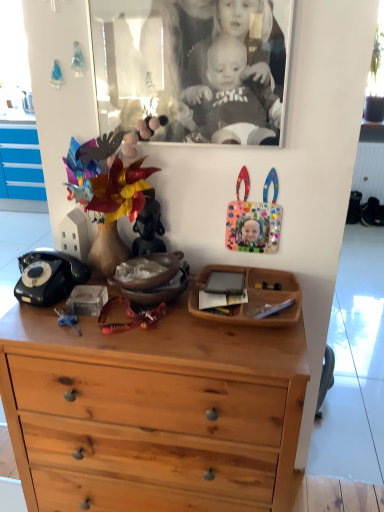
Question: Considering the relative sizes of black glass picture frame at upper center and light brown wood chest of drawers at center in the image provided, is black glass picture frame at upper center bigger than light brown wood chest of drawers at center?

Choices:
 (A) yes
 (B) no

Answer: (B)

Question: Is black glass picture frame at upper center shorter than light brown wood chest of drawers at center?

Choices:
 (A) no
 (B) yes

Answer: (B)

Question: Is black glass picture frame at upper center aimed at light brown wood chest of drawers at center?

Choices:
 (A) no
 (B) yes

Answer: (A)

Question: Is black glass picture frame at upper center closer to the viewer compared to light brown wood chest of drawers at center?

Choices:
 (A) yes
 (B) no

Answer: (B)

Question: Is black glass picture frame at upper center placed right next to light brown wood chest of drawers at center?

Choices:
 (A) yes
 (B) no

Answer: (B)

Question: Is point (109, 419) positioned closer to the camera than point (236, 80)?

Choices:
 (A) closer
 (B) farther

Answer: (B)

Question: In terms of size, does light brown wood chest of drawers at center appear bigger or smaller than black glass picture frame at upper center?

Choices:
 (A) big
 (B) small

Answer: (A)

Question: Considering the positions of light brown wood chest of drawers at center and black glass picture frame at upper center in the image, is light brown wood chest of drawers at center taller or shorter than black glass picture frame at upper center?

Choices:
 (A) short
 (B) tall

Answer: (B)

Question: Is light brown wood chest of drawers at center wider or thinner than black glass picture frame at upper center?

Choices:
 (A) thin
 (B) wide

Answer: (B)

Question: From the image's perspective, is light brown wood chest of drawers at center above or below colorful plastic frame at upper right, positioned as the 2th toy in left-to-right order?

Choices:
 (A) above
 (B) below

Answer: (B)

Question: Considering their positions, is light brown wood chest of drawers at center located in front of or behind colorful plastic frame at upper right, the 1th toy in the right-to-left sequence?

Choices:
 (A) behind
 (B) front

Answer: (B)

Question: Looking at the image, does light brown wood chest of drawers at center seem bigger or smaller compared to colorful plastic frame at upper right, the 1th toy in the right-to-left sequence?

Choices:
 (A) big
 (B) small

Answer: (A)

Question: Based on their positions, is light brown wood chest of drawers at center located to the left or right of colorful plastic frame at upper right, the 1th toy in the right-to-left sequence?

Choices:
 (A) left
 (B) right

Answer: (A)

Question: Based on their sizes in the image, would you say matte ceramic vase at center, which is the 2th toy from right to left, is bigger or smaller than black glass picture frame at upper center?

Choices:
 (A) small
 (B) big

Answer: (A)

Question: Would you say matte ceramic vase at center, placed as the first toy when sorted from left to right, is to the left or to the right of black glass picture frame at upper center in the picture?

Choices:
 (A) right
 (B) left

Answer: (B)